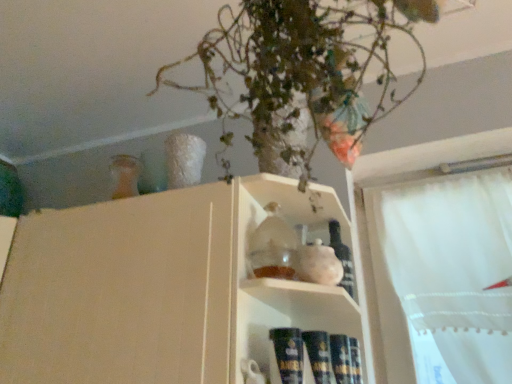
Question: Can we say green leafy plant at upper center lies outside translucent glass bottle at shelf center?

Choices:
 (A) yes
 (B) no

Answer: (A)

Question: Is the surface of green leafy plant at upper center in direct contact with translucent glass bottle at shelf center?

Choices:
 (A) yes
 (B) no

Answer: (B)

Question: From a real-world perspective, does green leafy plant at upper center sit lower than translucent glass bottle at shelf center?

Choices:
 (A) no
 (B) yes

Answer: (A)

Question: Can translucent glass bottle at shelf center be found inside green leafy plant at upper center?

Choices:
 (A) no
 (B) yes

Answer: (A)

Question: Considering the relative positions of green leafy plant at upper center and translucent glass bottle at shelf center in the image provided, is green leafy plant at upper center to the left of translucent glass bottle at shelf center from the viewer's perspective?

Choices:
 (A) yes
 (B) no

Answer: (A)

Question: Is green leafy plant at upper center inside the boundaries of translucent glass bottle at shelf center, or outside?

Choices:
 (A) outside
 (B) inside

Answer: (A)

Question: Does point (209, 87) appear closer or farther from the camera than point (347, 266)?

Choices:
 (A) closer
 (B) farther

Answer: (B)

Question: From a real-world perspective, is green leafy plant at upper center above or below translucent glass bottle at shelf center?

Choices:
 (A) above
 (B) below

Answer: (A)

Question: Based on their positions, is green leafy plant at upper center located to the left or right of translucent glass bottle at shelf center?

Choices:
 (A) left
 (B) right

Answer: (A)

Question: Is matte glass jar at center in front of or behind translucent glass bottle at shelf center in the image?

Choices:
 (A) front
 (B) behind

Answer: (A)

Question: Visually, is matte glass jar at center positioned to the left or to the right of translucent glass bottle at shelf center?

Choices:
 (A) right
 (B) left

Answer: (B)

Question: From the image's perspective, is matte glass jar at center located above or below translucent glass bottle at shelf center?

Choices:
 (A) below
 (B) above

Answer: (A)

Question: Looking at the image, does matte glass jar at center seem bigger or smaller compared to translucent glass bottle at shelf center?

Choices:
 (A) small
 (B) big

Answer: (B)

Question: Is translucent glass bottle at shelf center wider or thinner than matte glass jar at center?

Choices:
 (A) wide
 (B) thin

Answer: (B)

Question: From a real-world perspective, relative to matte glass jar at center, is translucent glass bottle at shelf center vertically above or below?

Choices:
 (A) above
 (B) below

Answer: (A)